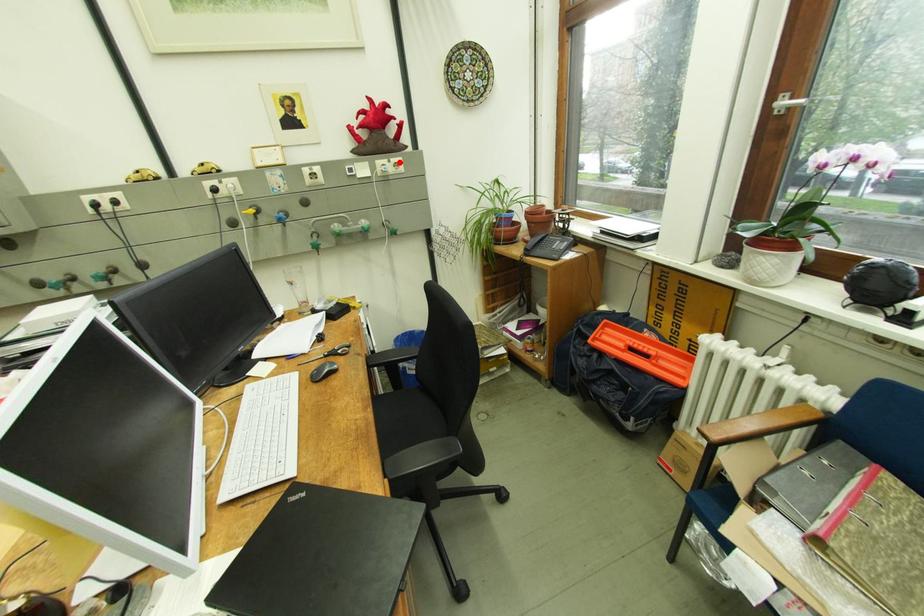
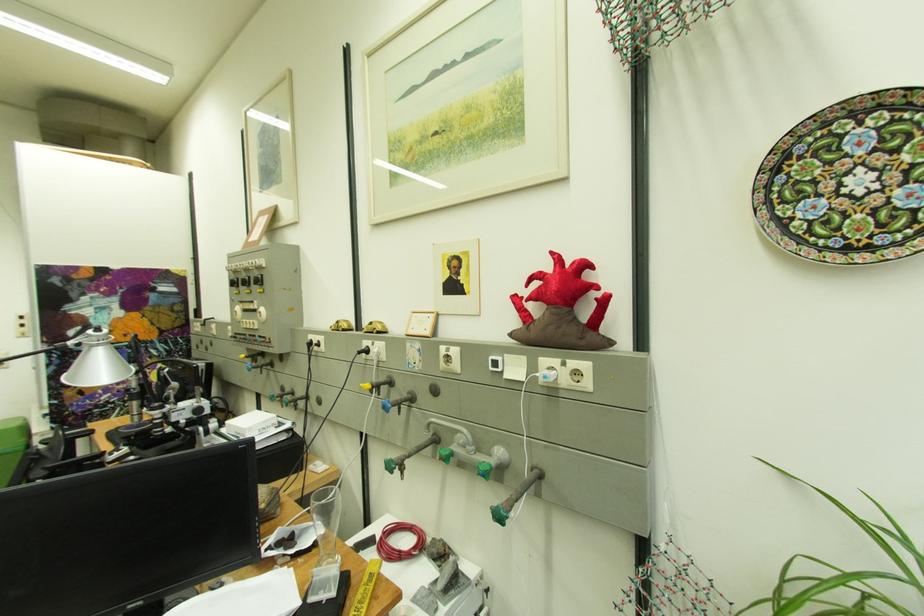
The point at the highlighted location is marked in the first image. Where is the corresponding point in the second image?

(575, 365)